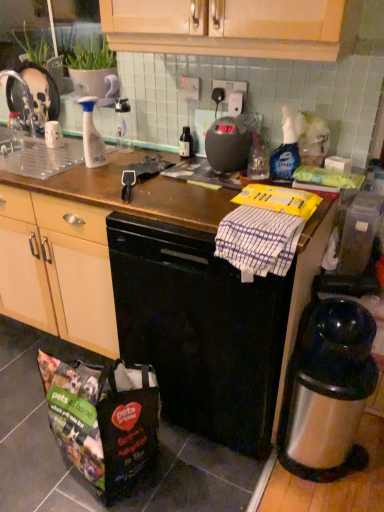
Question: Can you confirm if brown wooden counter top at center is thinner than white striped towel at center?

Choices:
 (A) no
 (B) yes

Answer: (A)

Question: Is brown wooden counter top at center surrounding white striped towel at center?

Choices:
 (A) yes
 (B) no

Answer: (A)

Question: Can you confirm if brown wooden counter top at center is positioned to the right of white striped towel at center?

Choices:
 (A) yes
 (B) no

Answer: (B)

Question: Is brown wooden counter top at center facing towards white striped towel at center?

Choices:
 (A) no
 (B) yes

Answer: (B)

Question: Can you confirm if brown wooden counter top at center is positioned to the left of white striped towel at center?

Choices:
 (A) yes
 (B) no

Answer: (A)

Question: Is black glass bottle at center, the second bottle from the right, situated inside polyester shopping bag at lower left or outside?

Choices:
 (A) outside
 (B) inside

Answer: (A)

Question: Considering the positions of black glass bottle at center, which is the 3th bottle in left-to-right order, and polyester shopping bag at lower left in the image, is black glass bottle at center, which is the 3th bottle in left-to-right order, wider or thinner than polyester shopping bag at lower left?

Choices:
 (A) wide
 (B) thin

Answer: (B)

Question: Visually, is black glass bottle at center, the second bottle from the right, positioned to the left or to the right of polyester shopping bag at lower left?

Choices:
 (A) right
 (B) left

Answer: (A)

Question: From their relative heights in the image, would you say black glass bottle at center, the second bottle from the right, is taller or shorter than polyester shopping bag at lower left?

Choices:
 (A) tall
 (B) short

Answer: (B)

Question: From the image's perspective, is clear plastic bottle at center, the 3th bottle viewed from the right, located above or below polyester shopping bag at lower left?

Choices:
 (A) below
 (B) above

Answer: (B)

Question: Considering the positions of clear plastic bottle at center, the 3th bottle viewed from the right, and polyester shopping bag at lower left in the image, is clear plastic bottle at center, the 3th bottle viewed from the right, taller or shorter than polyester shopping bag at lower left?

Choices:
 (A) tall
 (B) short

Answer: (B)

Question: Is clear plastic bottle at center, the 3th bottle viewed from the right, in front of or behind polyester shopping bag at lower left in the image?

Choices:
 (A) front
 (B) behind

Answer: (B)

Question: From a real-world perspective, is clear plastic bottle at center, the 2th bottle in the left-to-right sequence, physically located above or below polyester shopping bag at lower left?

Choices:
 (A) above
 (B) below

Answer: (A)

Question: Is point (130, 128) positioned closer to the camera than point (271, 306)?

Choices:
 (A) farther
 (B) closer

Answer: (A)

Question: Is clear plastic bottle at center, the 3th bottle viewed from the right, inside the boundaries of brown wooden counter top at center, or outside?

Choices:
 (A) outside
 (B) inside

Answer: (A)